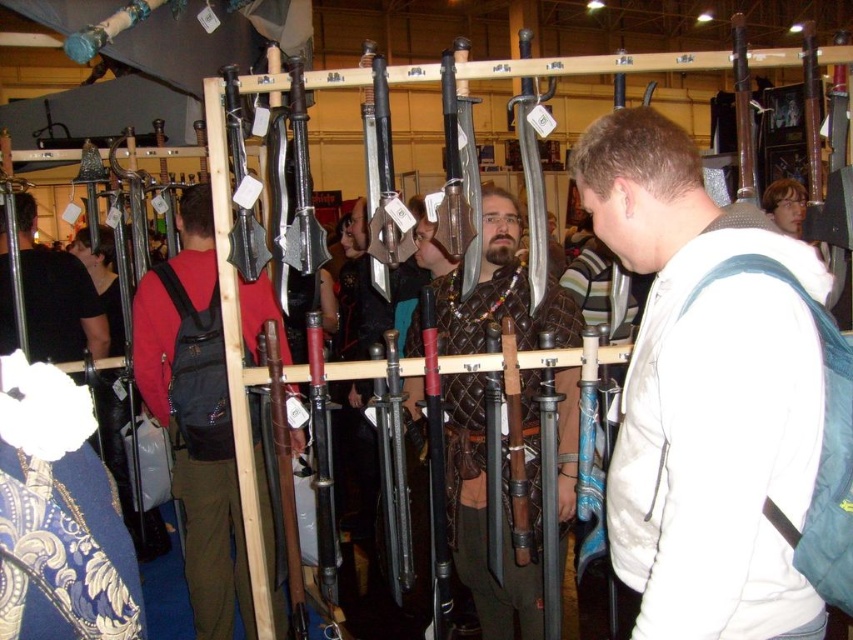
Between white fabric backpack at center and leather armor at center, which one has more height?

With more height is leather armor at center.

Which is more to the left, white fabric backpack at center or leather armor at center?

From the viewer's perspective, leather armor at center appears more on the left side.

Is point (784, 368) positioned before point (474, 328)?

Yes, point (784, 368) is closer to viewer.

Locate an element on the screen. The image size is (853, 640). white fabric backpack at center is located at coordinates (705, 394).

Is white fabric backpack at center bigger than matte black backpack at left?

Actually, white fabric backpack at center might be smaller than matte black backpack at left.

Can you confirm if white fabric backpack at center is wider than matte black backpack at left?

Incorrect, white fabric backpack at center's width does not surpass matte black backpack at left's.

Which is behind, point (781, 483) or point (90, 291)?

The point (90, 291) is more distant.

You are a GUI agent. You are given a task and a screenshot of the screen. Output one action in this format:
    pyautogui.click(x=<x>, y=<y>)
    Task: Click on the white fabric backpack at center
    This screenshot has height=640, width=853.
    Given the screenshot: What is the action you would take?
    pyautogui.click(x=705, y=394)

Between point (210, 433) and point (534, 401), which one is positioned in front?

Point (534, 401)

Which is more to the right, dark red backpack at center or leather armor at center?

From the viewer's perspective, leather armor at center appears more on the right side.

Is point (204, 589) farther from viewer compared to point (532, 388)?

Yes, it is behind point (532, 388).

Where is `dark red backpack at center`? This screenshot has height=640, width=853. dark red backpack at center is located at coordinates (195, 413).